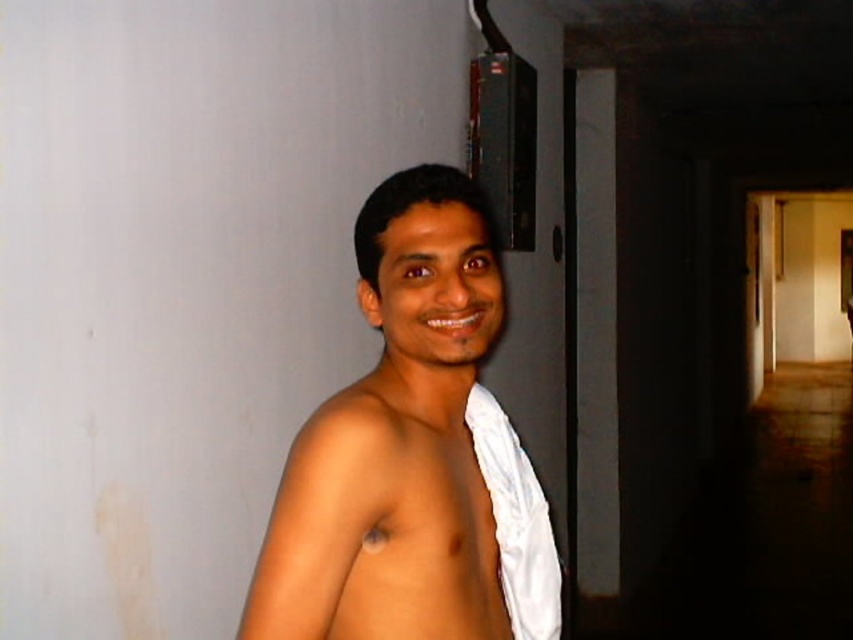
Question: Is white cloth at center wider than white cloth at right?

Choices:
 (A) no
 (B) yes

Answer: (B)

Question: Does white cloth at center appear on the left side of white cloth at right?

Choices:
 (A) no
 (B) yes

Answer: (B)

Question: Does white cloth at center have a larger size compared to white cloth at right?

Choices:
 (A) no
 (B) yes

Answer: (B)